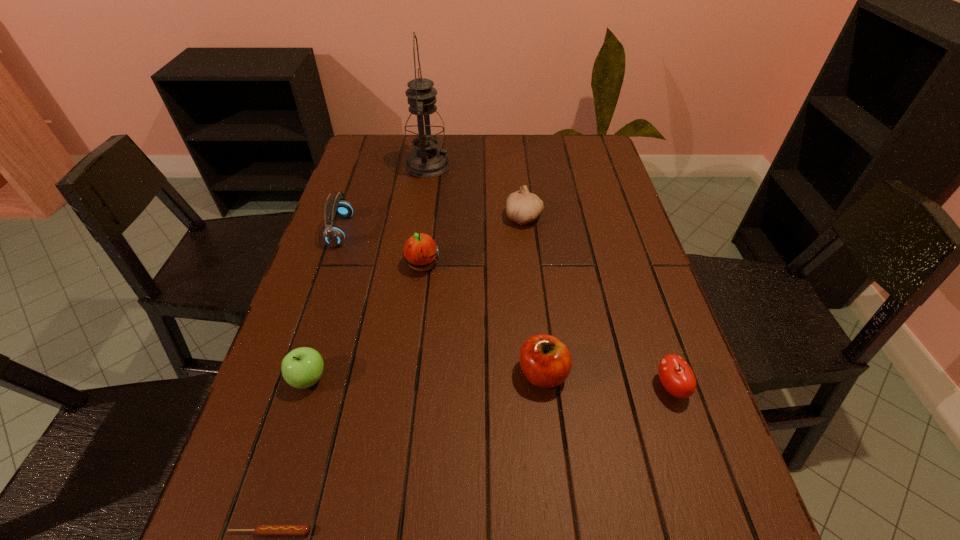
Find the location of `free space that is in between the leftmost apple and the oil lamp`. free space that is in between the leftmost apple and the oil lamp is located at coordinates (369, 272).

Locate an element on the screen. free space between the headset and the second apple from right to left is located at coordinates (442, 302).

The width and height of the screenshot is (960, 540). In order to click on unoccupied position between the tallest object and the garlic in this screenshot , I will do `click(476, 192)`.

Find the location of `free space that is in between the shortest object and the farthest apple`. free space that is in between the shortest object and the farthest apple is located at coordinates (347, 399).

At what (x,y) coordinates should I click in order to perform the action: click on blank region between the garlic and the third apple from left to right. Please return your answer as a coordinate pair (x, y). This screenshot has height=540, width=960. Looking at the image, I should click on (534, 295).

Locate an element on the screen. vacant area between the headset and the third apple from left to right is located at coordinates (442, 302).

The height and width of the screenshot is (540, 960). I want to click on vacant area that lies between the garlic and the headset, so click(x=433, y=224).

You are a GUI agent. You are given a task and a screenshot of the screen. Output one action in this format:
    pyautogui.click(x=<x>, y=<y>)
    Task: Click on the empty space that is in between the second apple from left to right and the garlic
    This screenshot has width=960, height=540.
    Given the screenshot: What is the action you would take?
    point(473,241)

Locate an element on the screen. This screenshot has width=960, height=540. unoccupied area between the farthest apple and the rightmost object is located at coordinates (546, 326).

Select which object appears as the fourth closest to the headset. Please provide its 2D coordinates. Your answer should be formatted as a tuple, i.e. [(x, y)], where the tuple contains the x and y coordinates of a point satisfying the conditions above.

[(523, 207)]